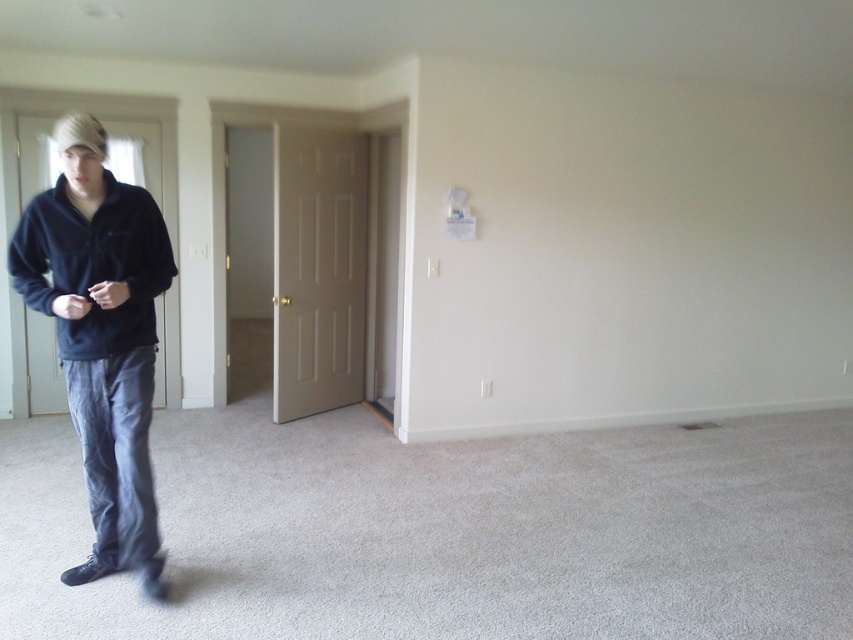
Is dark blue fleece jacket at left bigger than matte black sweatshirt at left?

Correct, dark blue fleece jacket at left is larger in size than matte black sweatshirt at left.

Measure the distance between dark blue fleece jacket at left and matte black sweatshirt at left.

They are 4.58 inches apart.

This screenshot has height=640, width=853. I want to click on dark blue fleece jacket at left, so click(x=102, y=336).